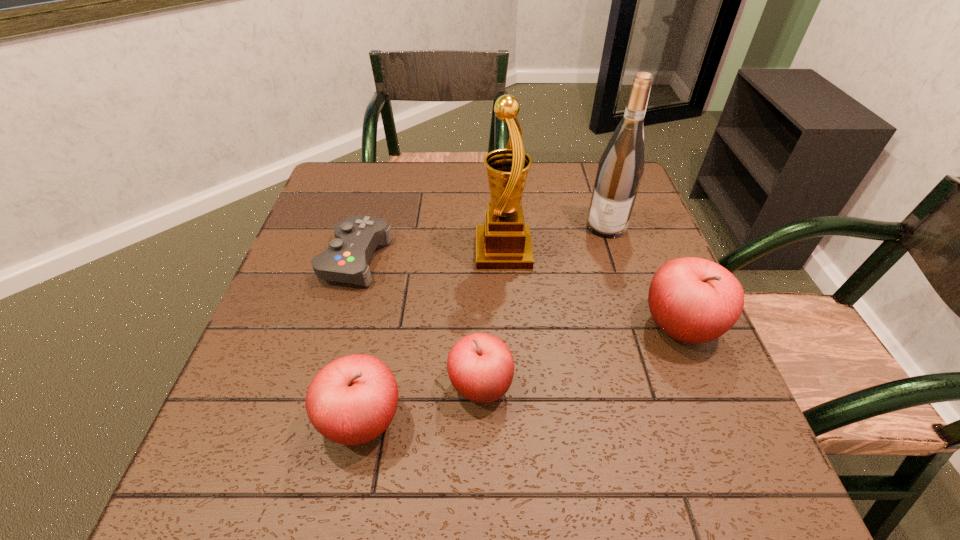
Identify the location of vacant space at the left edge of the desktop. (303, 331).

Where is `vacant space at the right edge of the desktop`? The image size is (960, 540). vacant space at the right edge of the desktop is located at coordinates (647, 323).

Where is `vacant space at the far left corner of the desktop`? vacant space at the far left corner of the desktop is located at coordinates (376, 180).

Where is `vacant space at the near left corner of the desktop`? Image resolution: width=960 pixels, height=540 pixels. vacant space at the near left corner of the desktop is located at coordinates (300, 403).

Where is `free space at the far right corner of the desktop`? free space at the far right corner of the desktop is located at coordinates (580, 177).

This screenshot has height=540, width=960. I want to click on vacant region at the near right corner, so 668,394.

Where is `free space that is in between the fifth tallest object and the leftmost apple`? This screenshot has width=960, height=540. free space that is in between the fifth tallest object and the leftmost apple is located at coordinates (421, 404).

Identify the location of free space between the rightmost apple and the control. (517, 294).

Locate an element on the screen. The height and width of the screenshot is (540, 960). empty location between the shortest object and the award is located at coordinates (429, 255).

Locate an element on the screen. free spot between the award and the wine bottle is located at coordinates (555, 239).